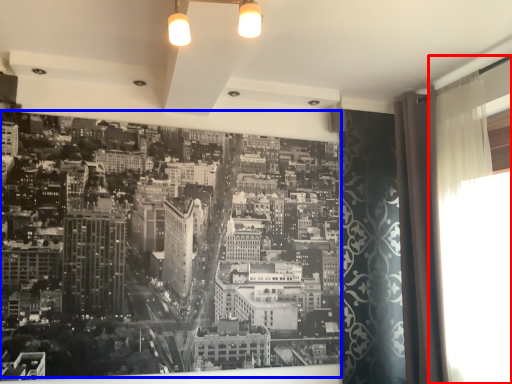
Question: Among these objects, which one is farthest to the camera, window screen (highlighted by a red box) or hotel (highlighted by a blue box)?

Choices:
 (A) window screen
 (B) hotel

Answer: (B)